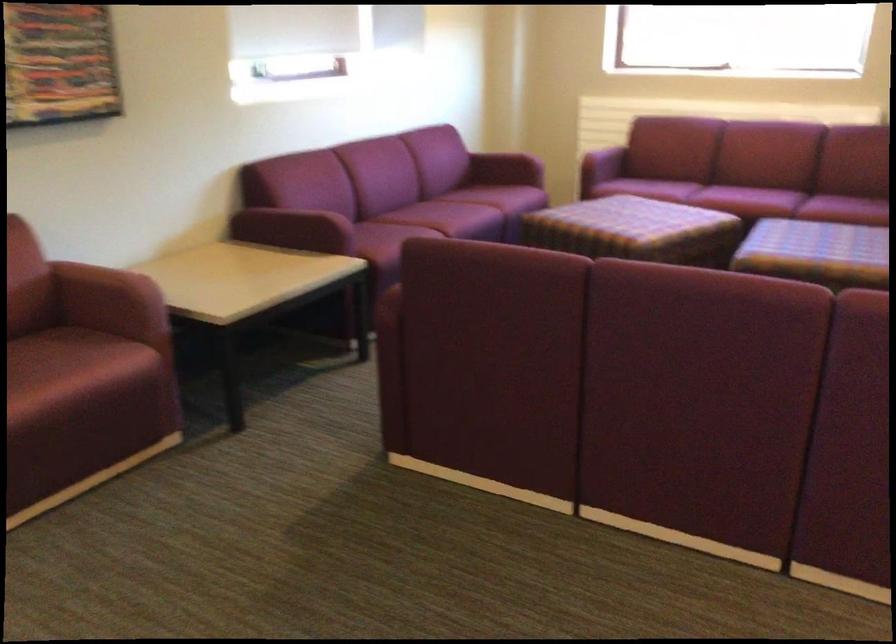
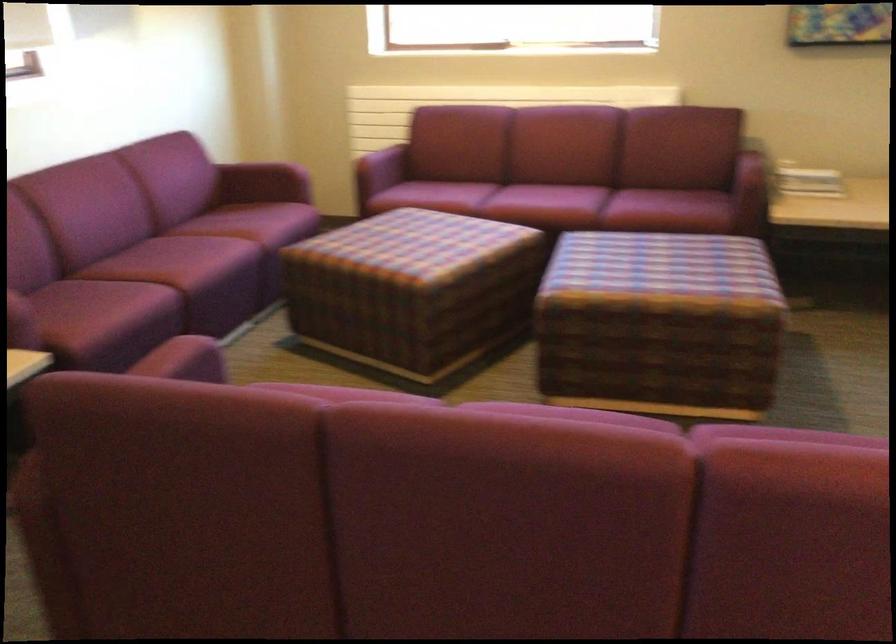
Where in the second image is the point corresponding to point (643, 187) from the first image?

(432, 196)